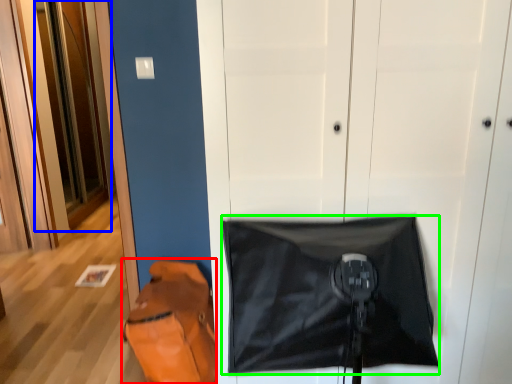
Question: Which is nearer to the messenger bag (highlighted by a red box)? door (highlighted by a blue box) or blanket (highlighted by a green box).

Choices:
 (A) door
 (B) blanket

Answer: (B)